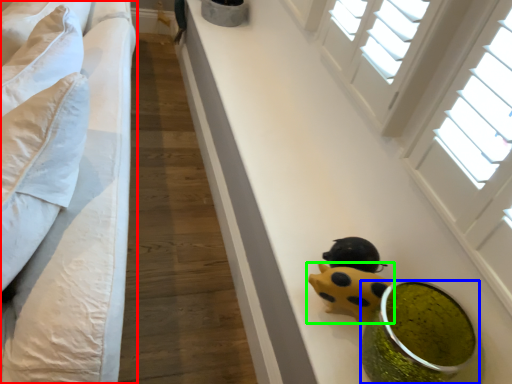
Question: Which is nearer to the furniture (highlighted by a red box)? food (highlighted by a blue box) or toy (highlighted by a green box).

Choices:
 (A) food
 (B) toy

Answer: (B)